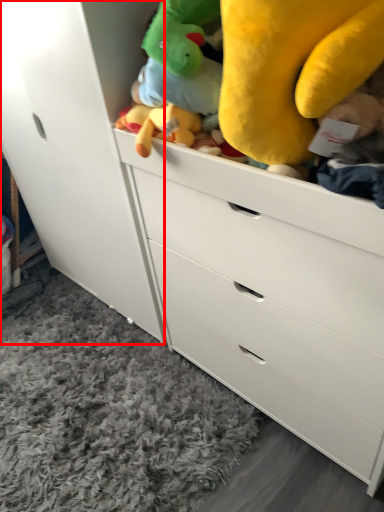
Question: From the image's perspective, considering the relative positions of cabinetry (annotated by the red box) and plain in the image provided, where is cabinetry (annotated by the red box) located with respect to the staircase?

Choices:
 (A) below
 (B) above

Answer: (B)